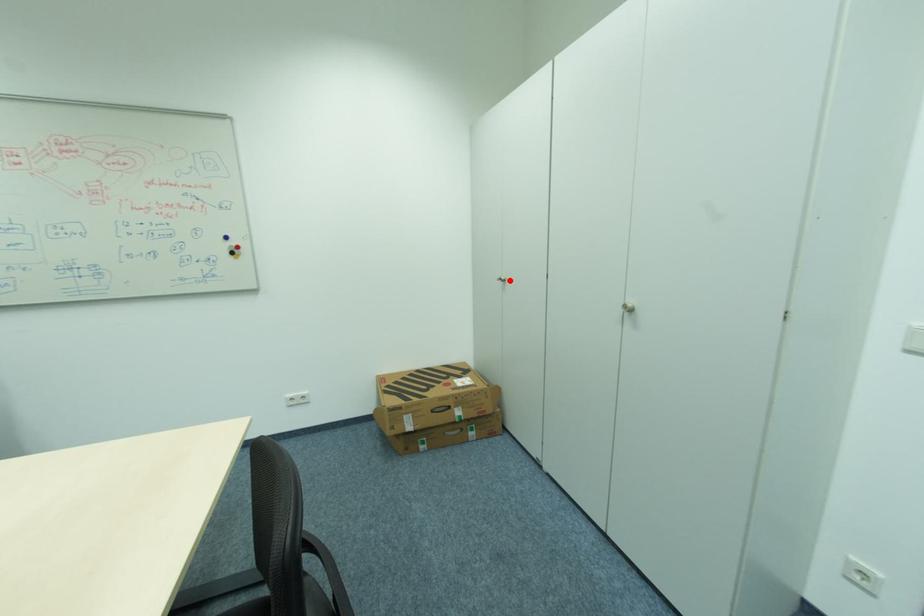
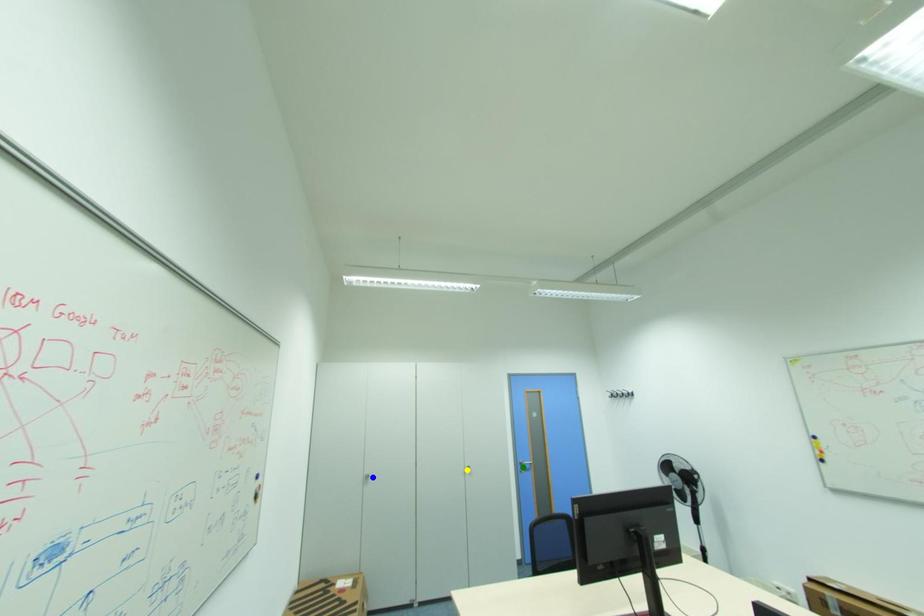
Question: I am providing you with two images of the same scene from different viewpoints. A red point is marked on the first image. You are given multiple points on the second image. Which spot in image 2 lines up with the point in image 1?

Choices:
 (A) yellow point
 (B) blue point
 (C) green point

Answer: (B)